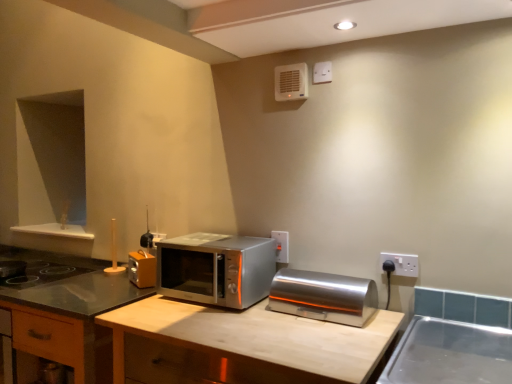
This screenshot has height=384, width=512. Identify the location of wooden cabinet at center. (65, 316).

The image size is (512, 384). Identify the location of satin silver microwave at center. (216, 268).

At what (x,y) coordinates should I click in order to perform the action: click on wooden at center. Please return your answer as a coordinate pair (x, y). The width and height of the screenshot is (512, 384). Looking at the image, I should click on (255, 341).

Locate an element on the screen. Image resolution: width=512 pixels, height=384 pixels. white plastic electrical outlet at right, the 1th electric outlet positioned from the right is located at coordinates (400, 264).

At what (x,y) coordinates should I click in order to perform the action: click on wooden cabinet at center. Please return your answer as a coordinate pair (x, y). The image size is (512, 384). Looking at the image, I should click on (65, 316).

Looking at this image, is there a large distance between white plastic electric outlet at center, acting as the 2th electric outlet starting from the right, and wooden cabinet at center?

Yes, white plastic electric outlet at center, acting as the 2th electric outlet starting from the right, and wooden cabinet at center are quite far apart.

Locate an element on the screen. Image resolution: width=512 pixels, height=384 pixels. the 1st electric outlet counting from the right side of the wooden cabinet at center is located at coordinates (281, 245).

Between white plastic electric outlet at center, acting as the 2th electric outlet starting from the right, and wooden cabinet at center, which one has less height?

Standing shorter between the two is white plastic electric outlet at center, acting as the 2th electric outlet starting from the right.

Is white plastic electric outlet at center, marked as the 1th electric outlet in a left-to-right arrangement, looking in the opposite direction of wooden cabinet at center?

That's not correct — white plastic electric outlet at center, marked as the 1th electric outlet in a left-to-right arrangement, is not looking away from wooden cabinet at center.

This screenshot has height=384, width=512. I want to click on electric outlet on the right of satin silver toaster at center, so click(x=400, y=264).

Can you tell me how much satin silver toaster at center and white plastic electrical outlet at right, placed as the second electric outlet when sorted from back to front, differ in facing direction?

The facing directions of satin silver toaster at center and white plastic electrical outlet at right, placed as the second electric outlet when sorted from back to front, are 0.321 degrees apart.

From the image's perspective, is satin silver toaster at center located above or below white plastic electrical outlet at right, placed as the second electric outlet when sorted from back to front?

satin silver toaster at center is below white plastic electrical outlet at right, placed as the second electric outlet when sorted from back to front.

From the picture: In terms of width, does satin silver toaster at center look wider or thinner when compared to white plastic electrical outlet at right, placed as the second electric outlet when sorted from back to front?

In the image, satin silver toaster at center appears to be wider than white plastic electrical outlet at right, placed as the second electric outlet when sorted from back to front.

Is white plastic air conditioner at upper center inside white plastic electrical outlet at right, the 1th electric outlet in the front-to-back sequence?

That's incorrect, white plastic air conditioner at upper center is not inside white plastic electrical outlet at right, the 1th electric outlet in the front-to-back sequence.

Considering their positions, is white plastic electrical outlet at right, the 1th electric outlet in the front-to-back sequence, located in front of or behind white plastic air conditioner at upper center?

white plastic electrical outlet at right, the 1th electric outlet in the front-to-back sequence, is positioned closer to the viewer than white plastic air conditioner at upper center.

Consider the image. Is white plastic electrical outlet at right, the 1th electric outlet in the front-to-back sequence, not near white plastic air conditioner at upper center?

They are positioned close to each other.

Is white plastic air conditioner at upper center shorter than satin silver microwave at center?

Yes.

Is white plastic air conditioner at upper center located outside satin silver microwave at center?

That's correct, white plastic air conditioner at upper center is outside of satin silver microwave at center.

Where is `microwave oven below the white plastic air conditioner at upper center (from a real-world perspective)`? microwave oven below the white plastic air conditioner at upper center (from a real-world perspective) is located at coordinates (216, 268).

Are satin silver microwave at center and white plastic electrical outlet at right, the 1th electric outlet in the front-to-back sequence, located far from each other?

Actually, satin silver microwave at center and white plastic electrical outlet at right, the 1th electric outlet in the front-to-back sequence, are a little close together.

This screenshot has width=512, height=384. Identify the location of microwave oven located below the white plastic electrical outlet at right, the 1th electric outlet in the front-to-back sequence (from the image's perspective). (216, 268).

From the image's perspective, which is below, satin silver microwave at center or white plastic electrical outlet at right, placed as the second electric outlet when sorted from back to front?

satin silver microwave at center, from the image's perspective.

Which is correct: satin silver microwave at center is inside white plastic electrical outlet at right, the 1th electric outlet in the front-to-back sequence, or outside of it?

satin silver microwave at center is located beyond the bounds of white plastic electrical outlet at right, the 1th electric outlet in the front-to-back sequence.

Consider the image. From a real-world perspective, is wooden cabinet at center below white plastic air conditioner at upper center?

Yes.

Based on the photo, which of these two, wooden cabinet at center or white plastic air conditioner at upper center, stands shorter?

white plastic air conditioner at upper center is shorter.

Are wooden cabinet at center and white plastic air conditioner at upper center beside each other?

No, wooden cabinet at center is not making contact with white plastic air conditioner at upper center.

Do you think wooden cabinet at center is within white plastic air conditioner at upper center, or outside of it?

The correct answer is: outside.

Is satin silver toaster at center oriented away from wooden at center?

No, satin silver toaster at center is not facing away from wooden at center.

Which is closer to the camera, (325, 273) or (336, 352)?

Clearly, point (325, 273) is more distant from the camera than point (336, 352).

Can you tell me how much satin silver toaster at center and wooden at center differ in facing direction?

The angular difference between satin silver toaster at center and wooden at center is 0.297 degrees.

Considering the sizes of objects satin silver toaster at center and wooden at center in the image provided, who is bigger, satin silver toaster at center or wooden at center?

Bigger between the two is wooden at center.

The height and width of the screenshot is (384, 512). What are the coordinates of `cabinetry in front of the white plastic electric outlet at center, marked as the 1th electric outlet in a left-to-right arrangement` in the screenshot? It's located at (65, 316).

This screenshot has height=384, width=512. In order to click on toaster to the left of white plastic electrical outlet at right, the 1th electric outlet in the front-to-back sequence in this screenshot , I will do `click(323, 296)`.

Looking at the image, which one is located closer to satin silver microwave at center, white plastic electric outlet at center, acting as the 2th electric outlet starting from the right, or wooden cabinet at center?

white plastic electric outlet at center, acting as the 2th electric outlet starting from the right, is positioned closer to the anchor satin silver microwave at center.

Looking at the image, which one is located closer to satin silver microwave at center, wooden at center or white plastic electric outlet at center, the 2th electric outlet in the front-to-back sequence?

wooden at center is positioned closer to the anchor satin silver microwave at center.

Estimate the real-world distances between objects in this image. Which object is further from satin silver microwave at center, wooden at center or white plastic air conditioner at upper center?

Among the two, white plastic air conditioner at upper center is located further to satin silver microwave at center.

From the image, which object appears to be farther from satin silver microwave at center, white plastic electric outlet at center, marked as the 1th electric outlet in a left-to-right arrangement, or white plastic electrical outlet at right, the 1th electric outlet in the front-to-back sequence?

Among the two, white plastic electrical outlet at right, the 1th electric outlet in the front-to-back sequence, is located further to satin silver microwave at center.

Looking at the image, which one is located closer to white plastic air conditioner at upper center, wooden at center or wooden cabinet at center?

wooden at center.

When comparing their distances from white plastic electrical outlet at right, arranged as the second electric outlet when viewed from the left, does satin silver microwave at center or wooden cabinet at center seem closer?

The object closer to white plastic electrical outlet at right, arranged as the second electric outlet when viewed from the left, is satin silver microwave at center.

In the scene shown: Considering their positions, is wooden cabinet at center positioned closer to white plastic electrical outlet at right, the 1th electric outlet in the front-to-back sequence, than satin silver microwave at center?

satin silver microwave at center lies closer to white plastic electrical outlet at right, the 1th electric outlet in the front-to-back sequence, than the other object.

Which object lies further to the anchor point satin silver microwave at center, satin silver toaster at center or white plastic air conditioner at upper center?

white plastic air conditioner at upper center.

Locate an element on the screen. electric outlet between satin silver microwave at center and white plastic electrical outlet at right, the 1th electric outlet positioned from the right is located at coordinates (281, 245).

The width and height of the screenshot is (512, 384). What are the coordinates of `counter top between wooden cabinet at center and satin silver toaster at center in the horizontal direction` in the screenshot? It's located at (255, 341).

You are a GUI agent. You are given a task and a screenshot of the screen. Output one action in this format:
    pyautogui.click(x=<x>, y=<y>)
    Task: Click on the electric outlet between white plastic air conditioner at upper center and white plastic electrical outlet at right, arranged as the second electric outlet when viewed from the left, in the up-down direction
    
    Given the screenshot: What is the action you would take?
    pyautogui.click(x=281, y=245)

Locate an element on the screen. Image resolution: width=512 pixels, height=384 pixels. microwave oven located between wooden cabinet at center and white plastic air conditioner at upper center in the left-right direction is located at coordinates (216, 268).